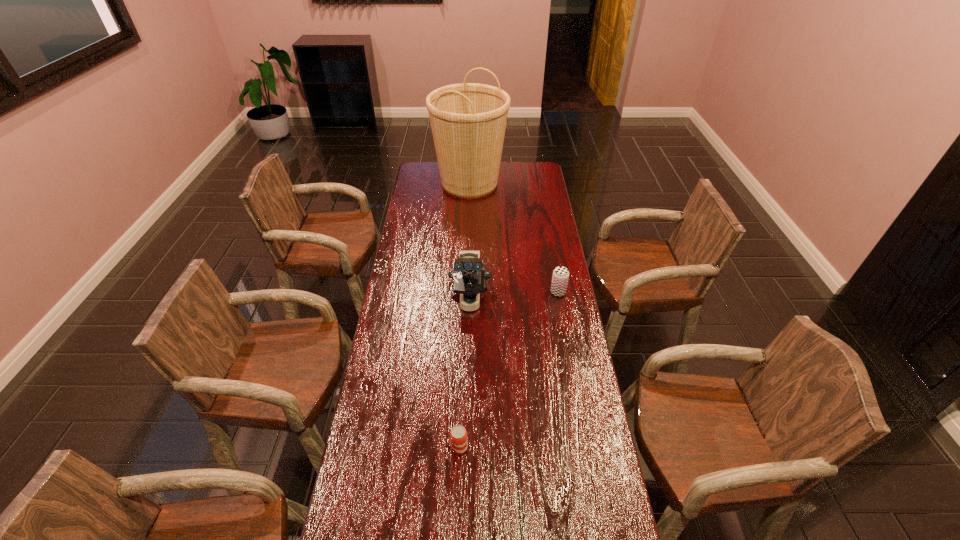
Find the location of a particular element. This screenshot has height=540, width=960. free location located on the left of the shorter beer can is located at coordinates (434, 448).

I want to click on object that is at the far edge, so click(x=468, y=120).

Where is `object that is at the left edge`? The height and width of the screenshot is (540, 960). object that is at the left edge is located at coordinates (468, 120).

Where is `object present at the right edge`? Image resolution: width=960 pixels, height=540 pixels. object present at the right edge is located at coordinates (560, 277).

Image resolution: width=960 pixels, height=540 pixels. I want to click on object at the far left corner, so pyautogui.click(x=468, y=120).

The width and height of the screenshot is (960, 540). I want to click on vacant space at the left edge, so click(404, 334).

I want to click on free location at the right edge, so click(x=586, y=417).

In order to click on free region at the far left corner in this screenshot , I will do `click(417, 168)`.

Find the location of a particular element. The width and height of the screenshot is (960, 540). free region at the far right corner of the desktop is located at coordinates (x=546, y=178).

The height and width of the screenshot is (540, 960). Identify the location of blank region between the basket and the shortest object. (465, 316).